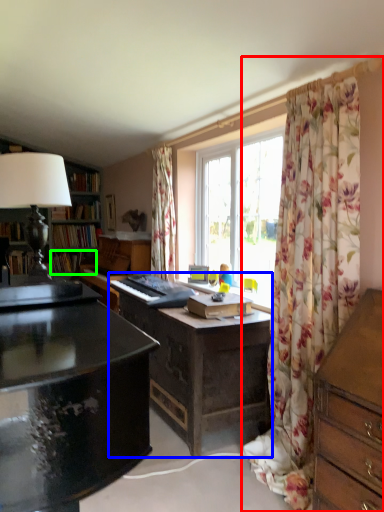
Question: Which object is positioned farthest from curtain (highlighted by a red box)? Select from desk (highlighted by a blue box) and book (highlighted by a green box).

Choices:
 (A) desk
 (B) book

Answer: (B)